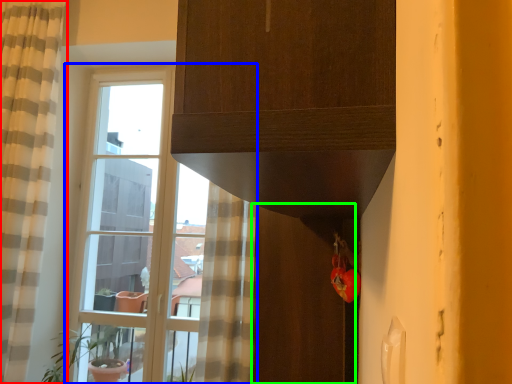
Question: Based on their relative distances, which object is nearer to curtain (highlighted by a red box)? Choose from window (highlighted by a blue box) and screen door (highlighted by a green box).

Choices:
 (A) window
 (B) screen door

Answer: (A)